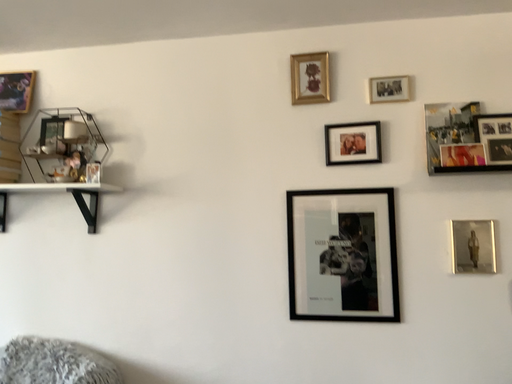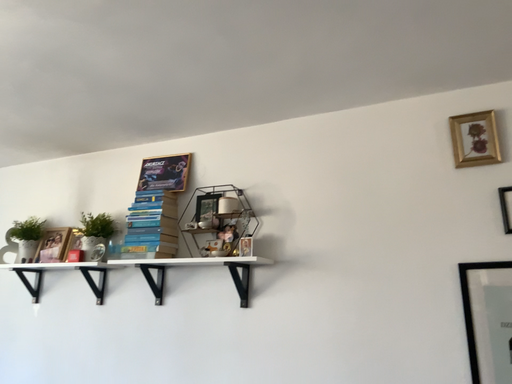
Question: Which way did the camera rotate in the video?

Choices:
 (A) rotated left
 (B) rotated right

Answer: (A)